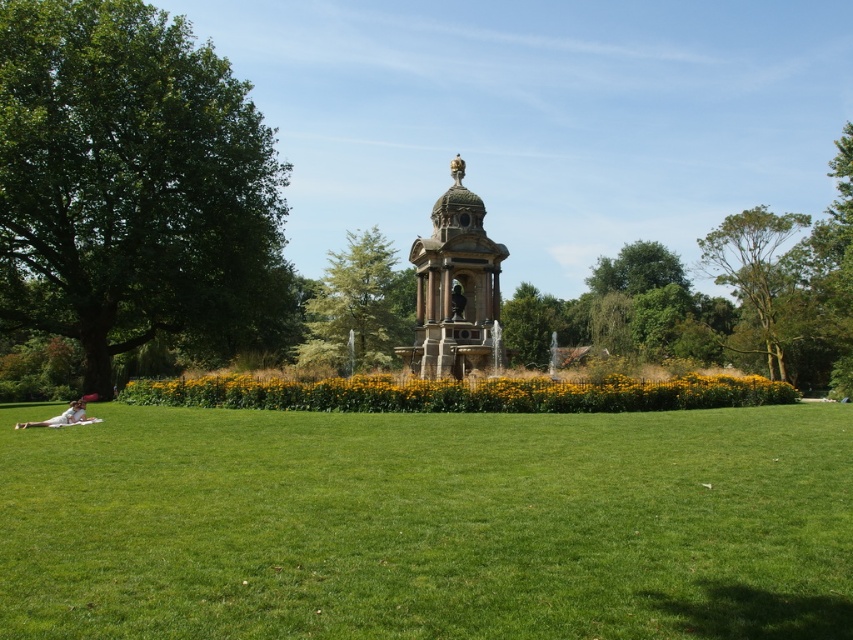
Question: Is green grassy field at center smaller than green leafy tree at left?

Choices:
 (A) no
 (B) yes

Answer: (B)

Question: Which object is farther from the camera taking this photo?

Choices:
 (A) green grassy field at center
 (B) white fabric person at lower left

Answer: (B)

Question: Does green leafy tree at left appear over bronze statue at center?

Choices:
 (A) no
 (B) yes

Answer: (B)

Question: Does bronze statue at center appear on the right side of green leafy tree at upper right?

Choices:
 (A) no
 (B) yes

Answer: (A)

Question: Among these points, which one is farthest from the camera?

Choices:
 (A) (735, 282)
 (B) (49, 424)

Answer: (A)

Question: Which of these objects is positioned closest to the green grassy field at center?

Choices:
 (A) green leafy tree at center
 (B) green leafy tree at left

Answer: (B)